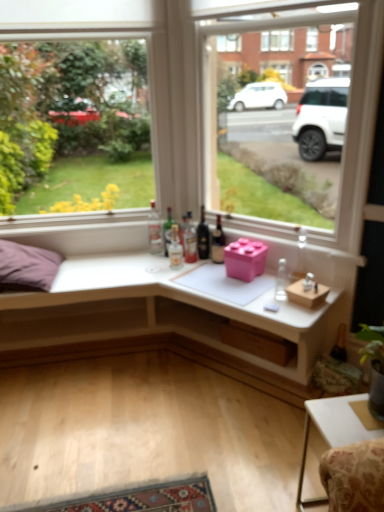
What are the coordinates of `vacant area that lies between translucent glass bottle at center, the 5th bottle when ordered from right to left, and wooden box at right, the 2th window box in the bottom-to-top sequence` in the screenshot? It's located at (228, 282).